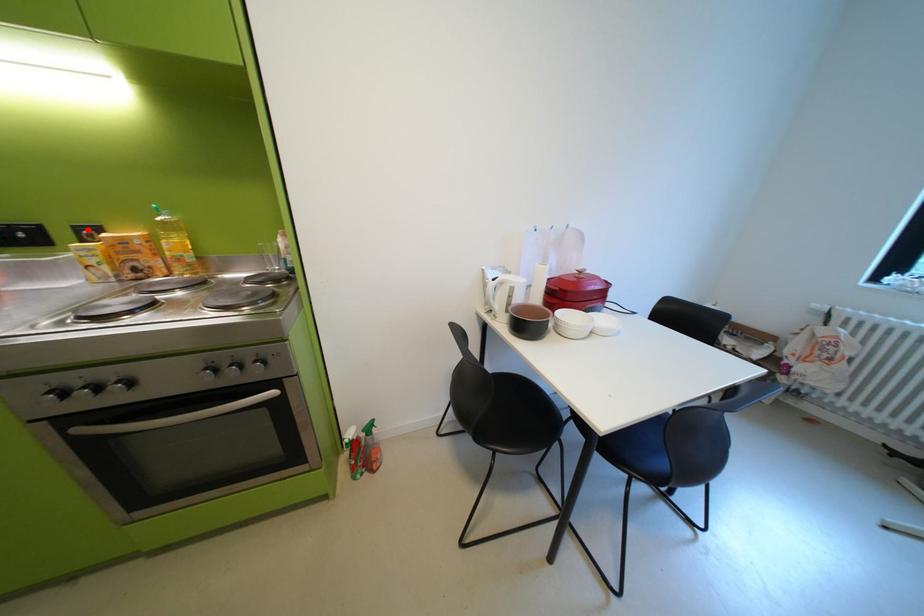
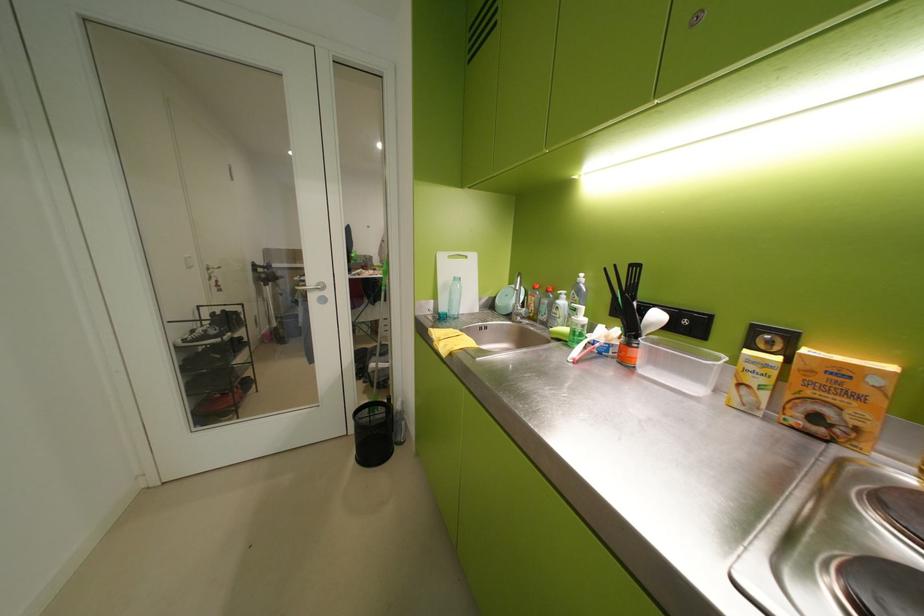
Locate, in the second image, the point that corresponds to the highlighted location in the first image.

(767, 331)